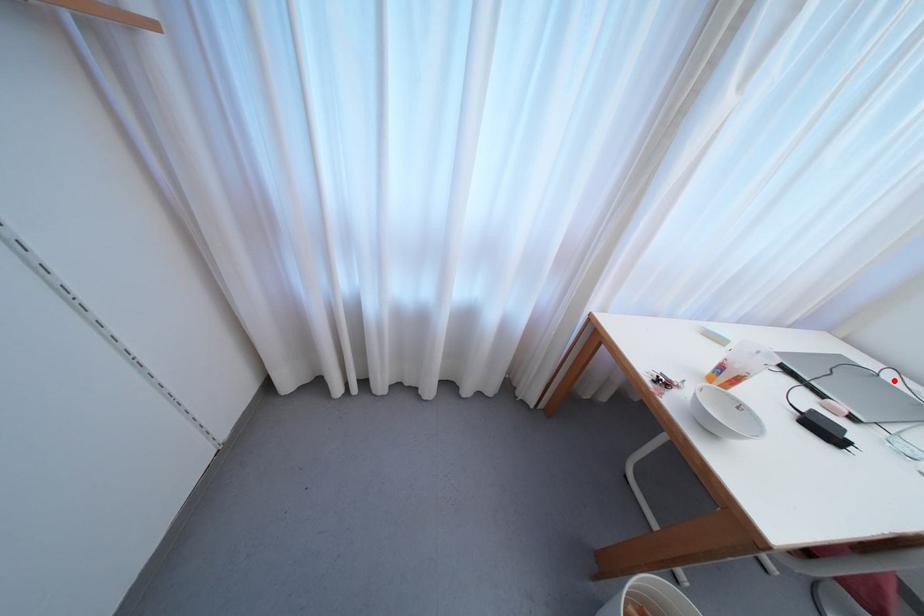
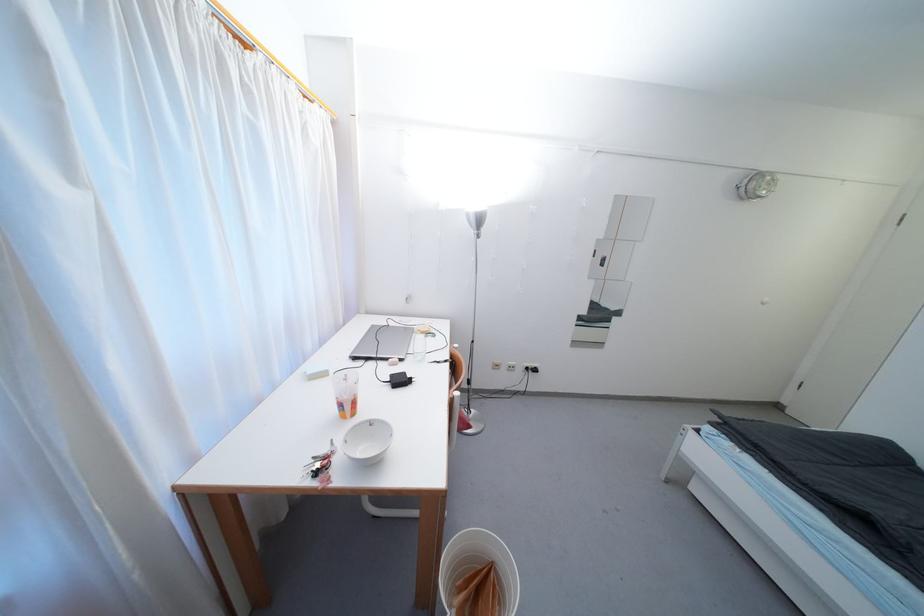
Question: A red point is marked in image1. In image2, is the corresponding 3D point closer to the camera or farther? Reply with the corresponding letter.

Choices:
 (A) The corresponding 3D point is closer.
 (B) The corresponding 3D point is farther.

Answer: (A)